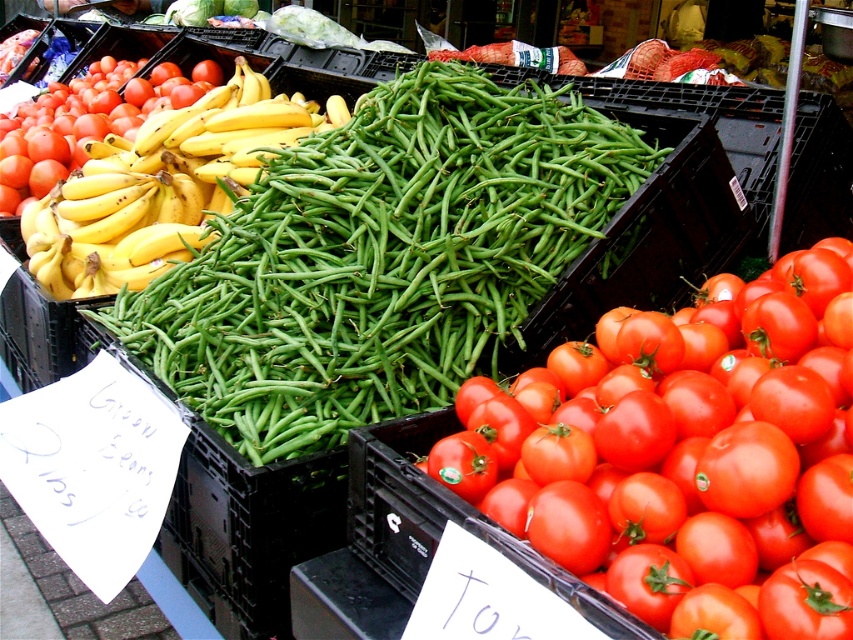
Question: Which point is farther to the camera?

Choices:
 (A) yellow matte bananas at left
 (B) shiny red tomato at center right
 (C) shiny red tomato at left

Answer: (C)

Question: Is green matte beans at center to the left of yellow matte bananas at left from the viewer's perspective?

Choices:
 (A) yes
 (B) no

Answer: (B)

Question: Which of these objects is positioned farthest from the shiny red tomato at center right?

Choices:
 (A) shiny red tomato at left
 (B) yellow matte bananas at left

Answer: (A)

Question: Which point is farther to the camera?

Choices:
 (A) shiny red tomato at left
 (B) yellow matte bananas at left
 (C) green matte beans at center
 (D) shiny red tomato at center right

Answer: (A)

Question: Does green matte beans at center have a larger size compared to shiny red tomato at center right?

Choices:
 (A) no
 (B) yes

Answer: (B)

Question: Can you confirm if shiny red tomato at center right is positioned to the left of yellow matte bananas at left?

Choices:
 (A) yes
 (B) no

Answer: (B)